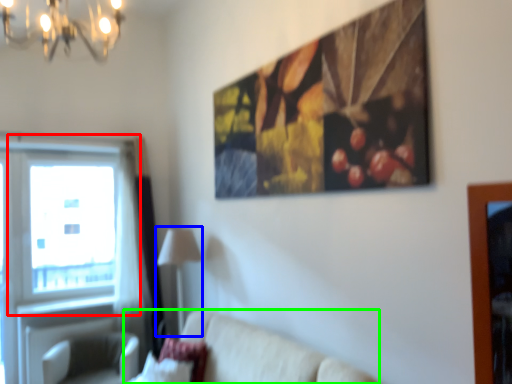
Question: Considering the real-world distances, which object is farthest from window (highlighted by a red box)? lamp (highlighted by a blue box) or studio couch (highlighted by a green box)?

Choices:
 (A) lamp
 (B) studio couch

Answer: (B)